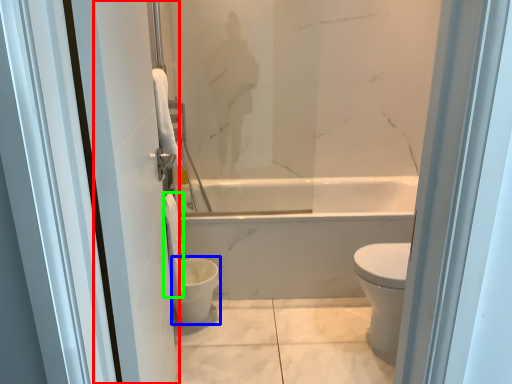
Question: Estimate the real-world distances between objects in this image. Which object is closer to screen door (highlighted by a red box), toilet bowl (highlighted by a blue box) or toilet paper (highlighted by a green box)?

Choices:
 (A) toilet bowl
 (B) toilet paper

Answer: (B)